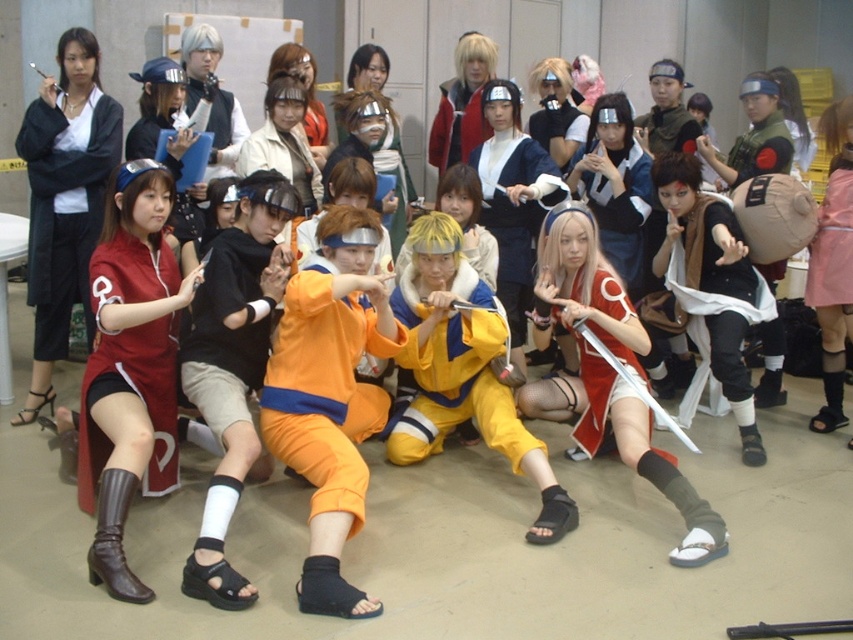
How much distance is there between orange fabric pants at center and matte black sword at center?

5.52 feet

Does orange fabric pants at center have a greater height compared to matte black sword at center?

No, orange fabric pants at center is not taller than matte black sword at center.

Who is more distant from viewer, (345, 378) or (671, 282)?

Point (671, 282)

You are a GUI agent. You are given a task and a screenshot of the screen. Output one action in this format:
    pyautogui.click(x=<x>, y=<y>)
    Task: Click on the orange fabric pants at center
    
    Given the screenshot: What is the action you would take?
    pyautogui.click(x=323, y=388)

Between yellow matte/soft fabric at center and pink fabric dress at center, which one is positioned lower?

yellow matte/soft fabric at center

Does point (477, 308) come behind point (840, 188)?

No, (477, 308) is closer to viewer.

This screenshot has height=640, width=853. What do you see at coordinates (454, 376) in the screenshot? I see `yellow matte/soft fabric at center` at bounding box center [454, 376].

The image size is (853, 640). Identify the location of yellow matte/soft fabric at center. (454, 376).

The height and width of the screenshot is (640, 853). What do you see at coordinates (131, 360) in the screenshot? I see `matte red cosplay outfit at left` at bounding box center [131, 360].

Is matte red cosplay outfit at left to the right of matte black jacket at upper left from the viewer's perspective?

Indeed, matte red cosplay outfit at left is positioned on the right side of matte black jacket at upper left.

This screenshot has width=853, height=640. Find the location of `matte red cosplay outfit at left`. matte red cosplay outfit at left is located at coordinates (131, 360).